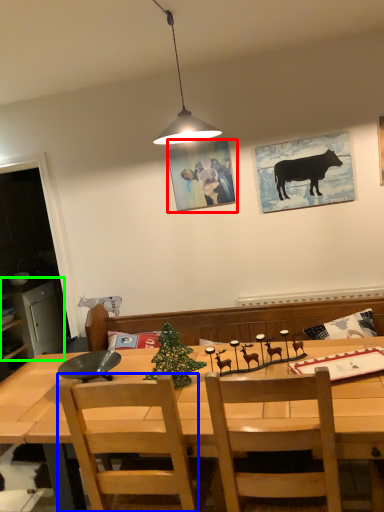
Question: Which object is the farthest from picture frame (highlighted by a red box)? Choose among these: chair (highlighted by a blue box) or cabinetry (highlighted by a green box).

Choices:
 (A) chair
 (B) cabinetry

Answer: (B)